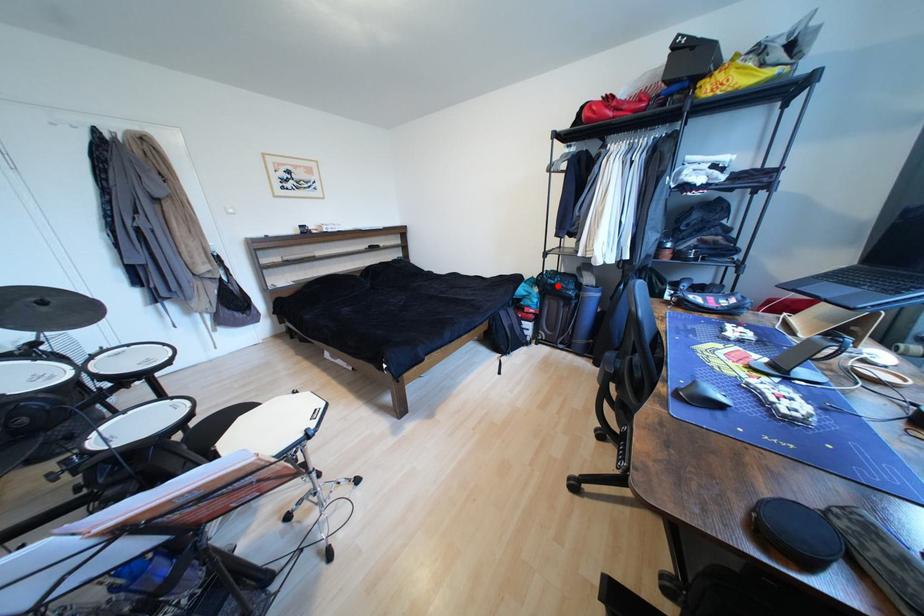
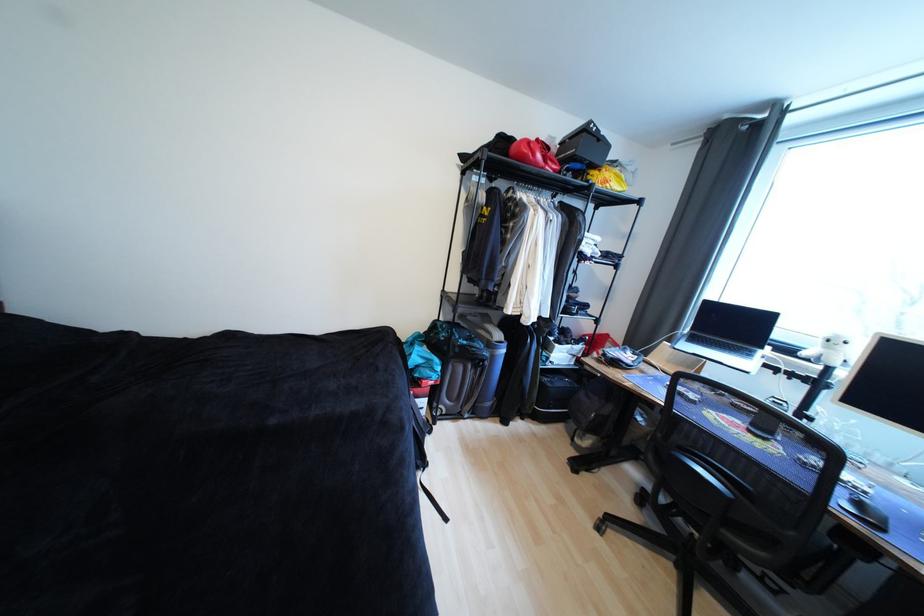
Where in the second image is the point corresponding to the highlighted location from the first image?

(469, 347)